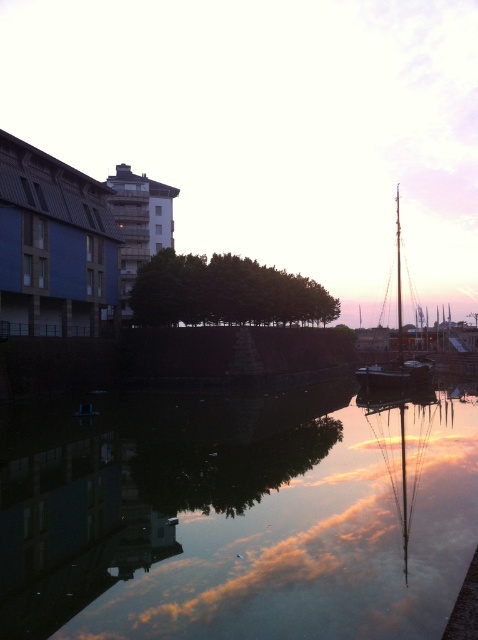
In the scene shown: You are a delivery drone that needs to fly from the smooth reflective water at center to the wooden sailboat at right. The minimum safe altitude for your drone is 10 meters. Can you safely navigate the route without any obstacles?

The distance between smooth reflective water at center and wooden sailboat at right is 39.53 meters. Since the minimum safe altitude is 10 meters, the drone can safely navigate the route as long as there are no obstacles in the flight path. However, the provided information does not mention any obstacles, so we assume the route is clear.

You are standing at the point with coordinates (237,515) in the urban waterfront scene. What do you observe around you?

At point (237,515) lies smooth reflective water at center.

You are standing at the waterfront and want to toss a pebble into the smooth reflective water at center. Considering the distance between you and the water, will the pebble reach the water if you throw it with a typical arm strength?

The distance between you and the smooth reflective water at center is 8.55 meters. Since a typical throw can reach about 15 meters, the pebble will likely reach the water.